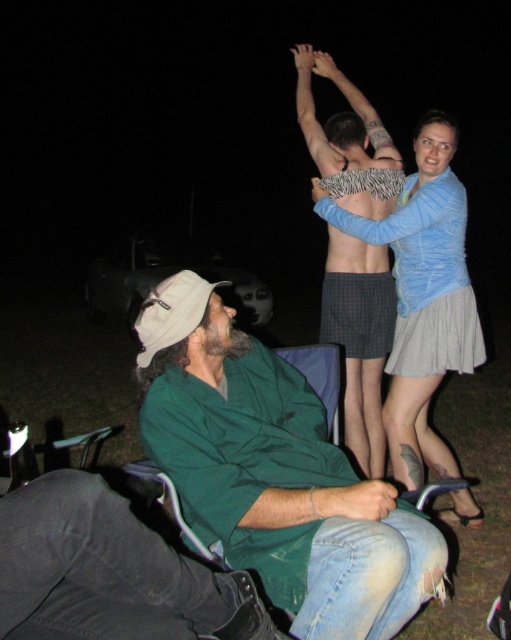
What is the object located at the coordinates point (322, 129) in the image?

The object located at point (322, 129) is the zebra patterned fabric at center.